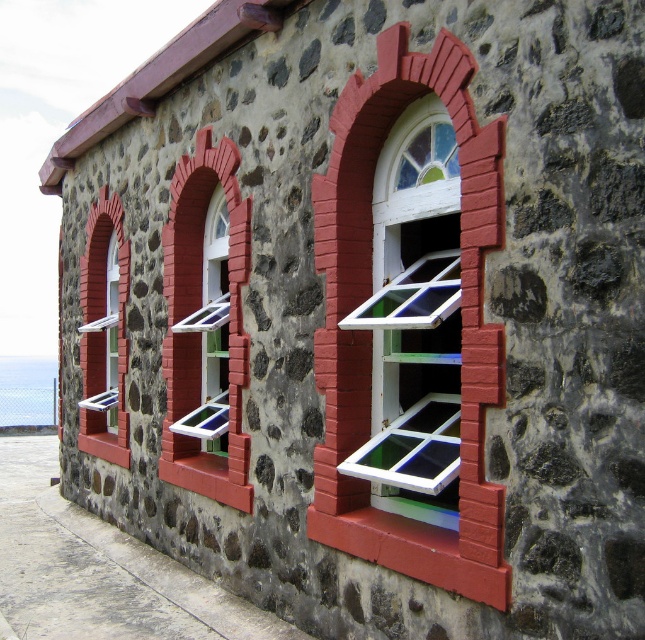
Question: Which of the following is the closest to the observer?

Choices:
 (A) (101, 385)
 (B) (213, 321)

Answer: (B)

Question: Can you confirm if matte glass window at center is smaller than matte glass window at left?

Choices:
 (A) yes
 (B) no

Answer: (A)

Question: Does white painted wood at center have a larger size compared to matte glass window at left?

Choices:
 (A) yes
 (B) no

Answer: (B)

Question: Which object is closer to the camera taking this photo?

Choices:
 (A) white painted wood at center
 (B) matte glass window at left
 (C) matte glass window at center

Answer: (A)

Question: Which point is farther to the camera?

Choices:
 (A) matte glass window at center
 (B) matte glass window at left

Answer: (B)

Question: Observing the image, what is the correct spatial positioning of matte glass window at center in reference to matte glass window at left?

Choices:
 (A) above
 (B) below

Answer: (A)